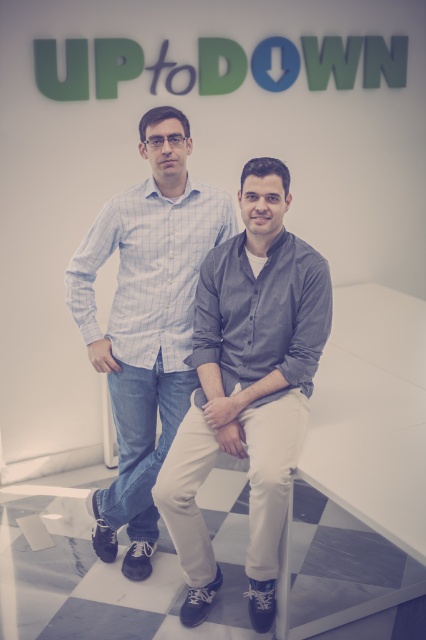
What is the color of the shirt at the location of the point with coordinates (247, 387)?

The point at coordinates (247, 387) is located on the dark gray cotton shirt at center, so the color is dark gray.

Based on the photo, you are trying to locate the dark gray cotton shirt at center in the image. According to the coordinates provided, where exactly is it positioned?

The dark gray cotton shirt at center is located at point coordinates of 0.605 on the x axis and 0.582 on the y axis.